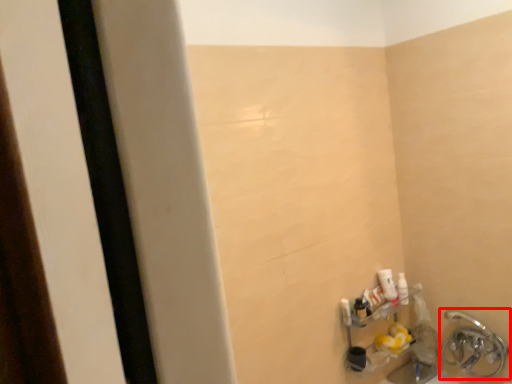
Question: From the image's perspective, what is the correct spatial positioning of plumbing fixture (annotated by the red box) in reference to toiletry?

Choices:
 (A) above
 (B) below

Answer: (B)